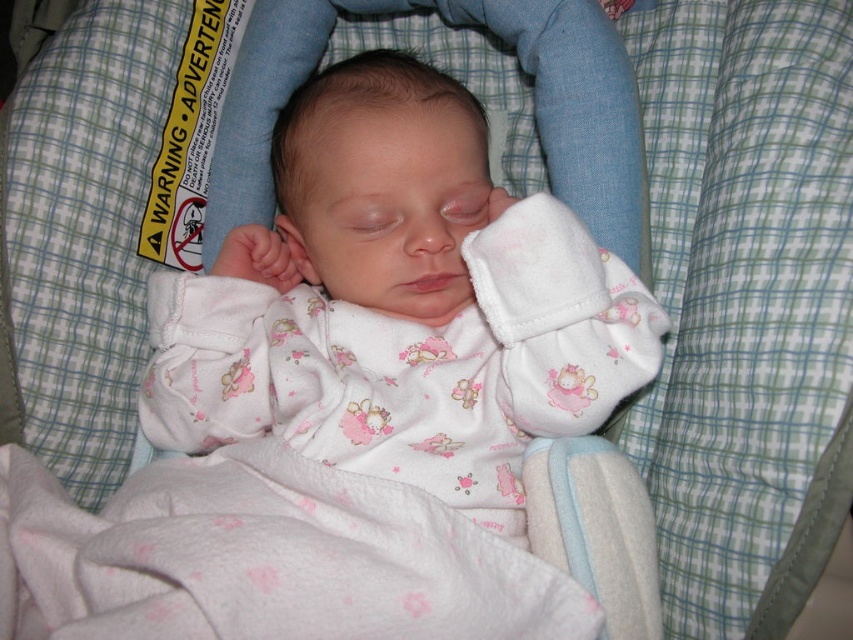
Question: Can you confirm if white soft fabric baby at center is wider than white fleece blanket at center?

Choices:
 (A) no
 (B) yes

Answer: (A)

Question: Which object is closer to the camera taking this photo?

Choices:
 (A) white fleece blanket at center
 (B) white soft fabric baby at center

Answer: (A)

Question: Does white soft fabric baby at center have a greater width compared to white fleece blanket at center?

Choices:
 (A) no
 (B) yes

Answer: (A)

Question: Is white soft fabric baby at center above white fleece blanket at center?

Choices:
 (A) yes
 (B) no

Answer: (A)

Question: Which of the following is the farthest from the observer?

Choices:
 (A) (192, 348)
 (B) (315, 577)

Answer: (A)

Question: Which object appears farthest from the camera in this image?

Choices:
 (A) white soft fabric baby at center
 (B) white fleece blanket at center

Answer: (A)